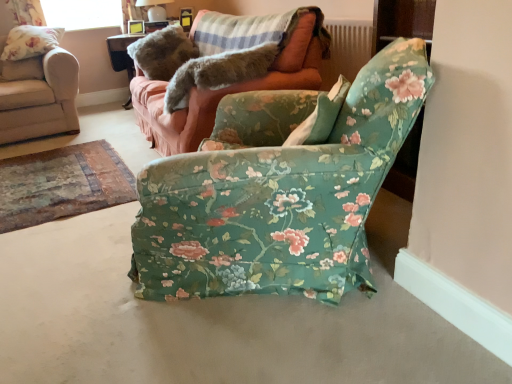
Question: Is matte white lampshade at upper center bigger than beige fabric chair at upper left, arranged as the second chair when viewed from the right?

Choices:
 (A) no
 (B) yes

Answer: (A)

Question: Is matte white lampshade at upper center wider than beige fabric chair at upper left, marked as the second chair in a front-to-back arrangement?

Choices:
 (A) no
 (B) yes

Answer: (A)

Question: Does matte white lampshade at upper center have a lesser height compared to beige fabric chair at upper left, the 1th chair in the back-to-front sequence?

Choices:
 (A) no
 (B) yes

Answer: (B)

Question: Is matte white lampshade at upper center to the right of beige fabric chair at upper left, arranged as the second chair when viewed from the right, from the viewer's perspective?

Choices:
 (A) no
 (B) yes

Answer: (B)

Question: Is beige fabric chair at upper left, the 1th chair in the back-to-front sequence, at the back of matte white lampshade at upper center?

Choices:
 (A) yes
 (B) no

Answer: (B)

Question: Can you confirm if matte white lampshade at upper center is smaller than beige fabric chair at upper left, positioned as the 1th chair in left-to-right order?

Choices:
 (A) yes
 (B) no

Answer: (A)

Question: Considering the relative sizes of floral fabric pillow at upper left and matte wooden picture frame at upper center in the image provided, is floral fabric pillow at upper left smaller than matte wooden picture frame at upper center?

Choices:
 (A) no
 (B) yes

Answer: (A)

Question: Does floral fabric pillow at upper left have a greater height compared to matte wooden picture frame at upper center?

Choices:
 (A) no
 (B) yes

Answer: (B)

Question: Is floral fabric pillow at upper left far away from matte wooden picture frame at upper center?

Choices:
 (A) no
 (B) yes

Answer: (B)

Question: Is floral fabric pillow at upper left at the left side of matte wooden picture frame at upper center?

Choices:
 (A) no
 (B) yes

Answer: (B)

Question: Considering the relative sizes of floral fabric pillow at upper left and matte wooden picture frame at upper center in the image provided, is floral fabric pillow at upper left shorter than matte wooden picture frame at upper center?

Choices:
 (A) no
 (B) yes

Answer: (A)

Question: Is floral fabric pillow at upper left beside matte wooden picture frame at upper center?

Choices:
 (A) no
 (B) yes

Answer: (A)

Question: From the image's perspective, would you say furry gray cat at upper center is positioned over matte wooden picture frame at upper center?

Choices:
 (A) yes
 (B) no

Answer: (B)